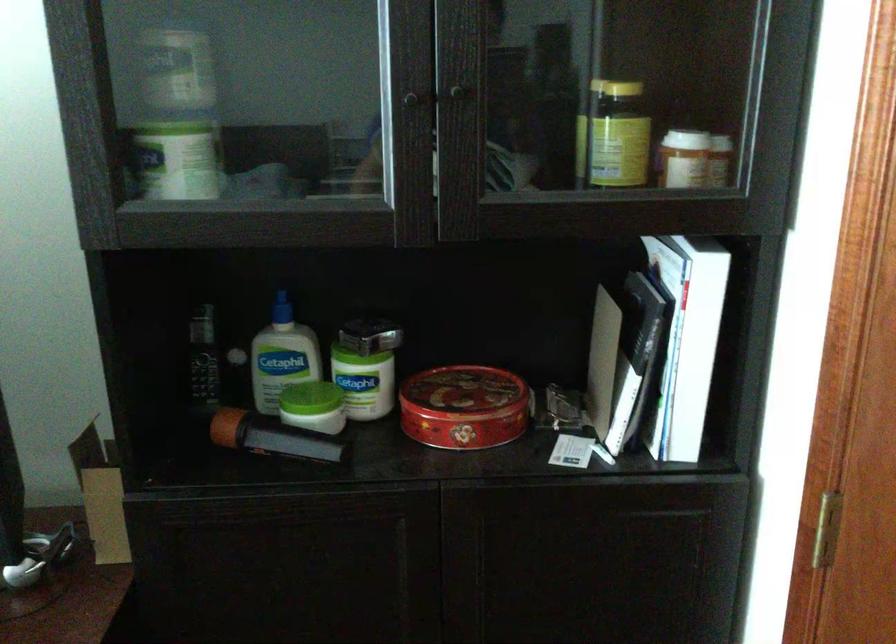
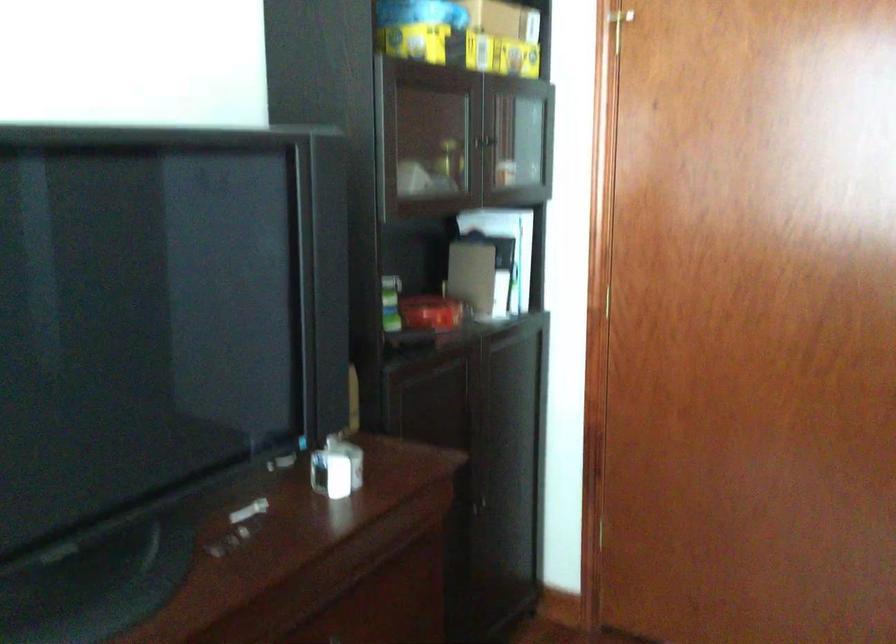
Where in the second image is the point corresponding to point 428,412 from the first image?

(431, 313)